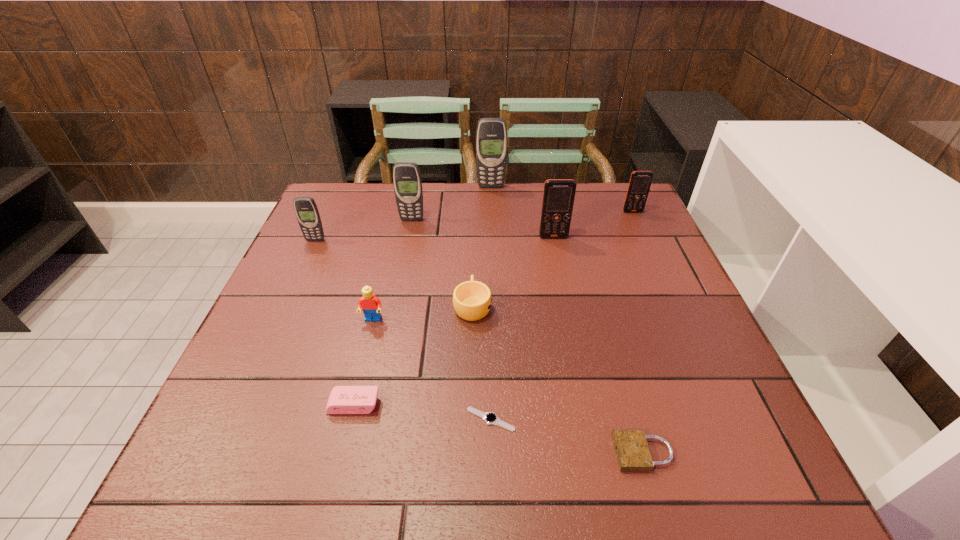
You are a GUI agent. You are given a task and a screenshot of the screen. Output one action in this format:
    pyautogui.click(x=<x>, y=<y>)
    Task: Click on the blank area located 0.060m on the back of the watch
    This screenshot has width=960, height=540.
    Given the screenshot: What is the action you would take?
    pyautogui.click(x=491, y=380)

This screenshot has width=960, height=540. I want to click on object that is at the near edge, so click(x=631, y=447).

Locate an element on the screen. object present at the left edge is located at coordinates (306, 210).

The image size is (960, 540). In order to click on object that is at the right edge in this screenshot , I will do `click(640, 182)`.

The height and width of the screenshot is (540, 960). What are the coordinates of `object positioned at the far right corner` in the screenshot? It's located at (640, 182).

Locate an element on the screen. Image resolution: width=960 pixels, height=540 pixels. vacant space at the far edge of the desktop is located at coordinates coord(523,187).

At what (x,y) coordinates should I click in order to perform the action: click on free space at the near edge of the desktop. Please return your answer as a coordinate pair (x, y). Looking at the image, I should click on (443, 483).

At what (x,y) coordinates should I click in order to perform the action: click on vacant space at the left edge of the desktop. Please return your answer as a coordinate pair (x, y). This screenshot has width=960, height=540. Looking at the image, I should click on (315, 357).

This screenshot has width=960, height=540. Identify the location of vacant space at the right edge of the desktop. (631, 287).

Find the location of `blank space at the far left corner of the desktop`. blank space at the far left corner of the desktop is located at coordinates (326, 208).